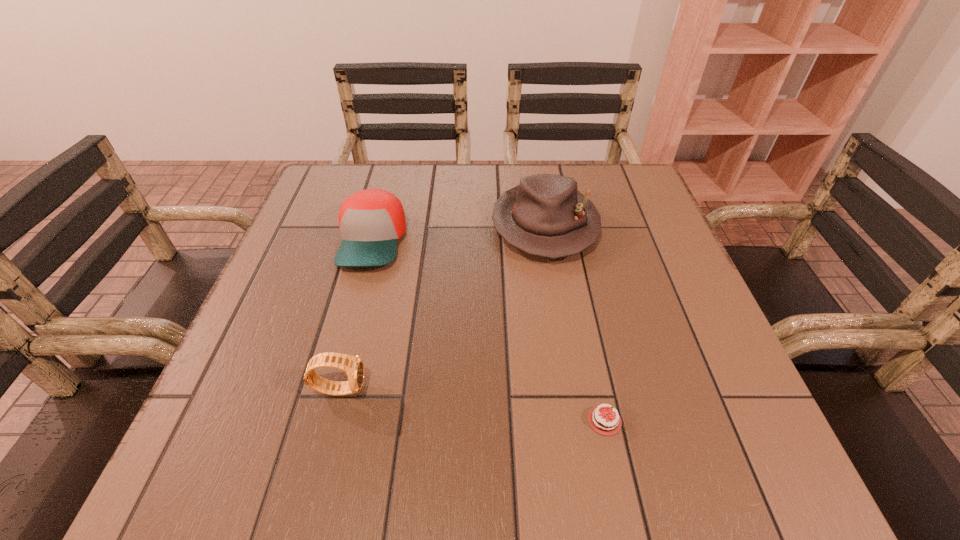
This screenshot has width=960, height=540. Identify the location of object positioned at the near edge. (602, 421).

Identify the location of baseball cap located at the left edge. (371, 221).

You are a GUI agent. You are given a task and a screenshot of the screen. Output one action in this format:
    pyautogui.click(x=<x>, y=<y>)
    Task: Click on the watch that is at the left edge
    The height and width of the screenshot is (540, 960).
    Given the screenshot: What is the action you would take?
    pyautogui.click(x=353, y=365)

In order to click on object at the right edge in this screenshot , I will do `click(546, 216)`.

What are the coordinates of `object that is at the far left corner` in the screenshot? It's located at [x=371, y=221].

Where is `object that is at the far right corner`? object that is at the far right corner is located at coordinates (546, 216).

At what (x,y) coordinates should I click in order to perform the action: click on vacant position at the far edge of the desktop. Please return your answer as a coordinate pair (x, y). Looking at the image, I should click on (511, 170).

Locate an element on the screen. free space at the near edge of the desktop is located at coordinates (447, 462).

The image size is (960, 540). I want to click on vacant space at the left edge of the desktop, so click(317, 371).

In the image, there is a desktop. What are the coordinates of `vacant space at the right edge` in the screenshot? It's located at (682, 356).